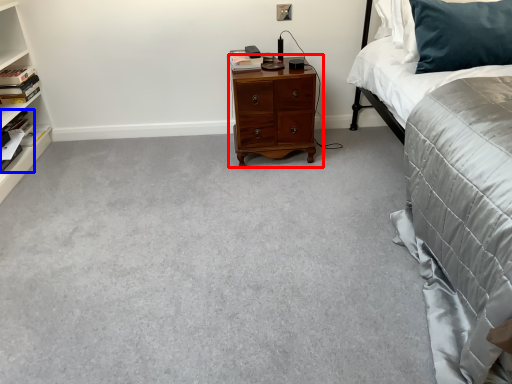
Question: Which of the following is the closest to the observer, nightstand (highlighted by a red box) or book (highlighted by a blue box)?

Choices:
 (A) nightstand
 (B) book

Answer: (B)